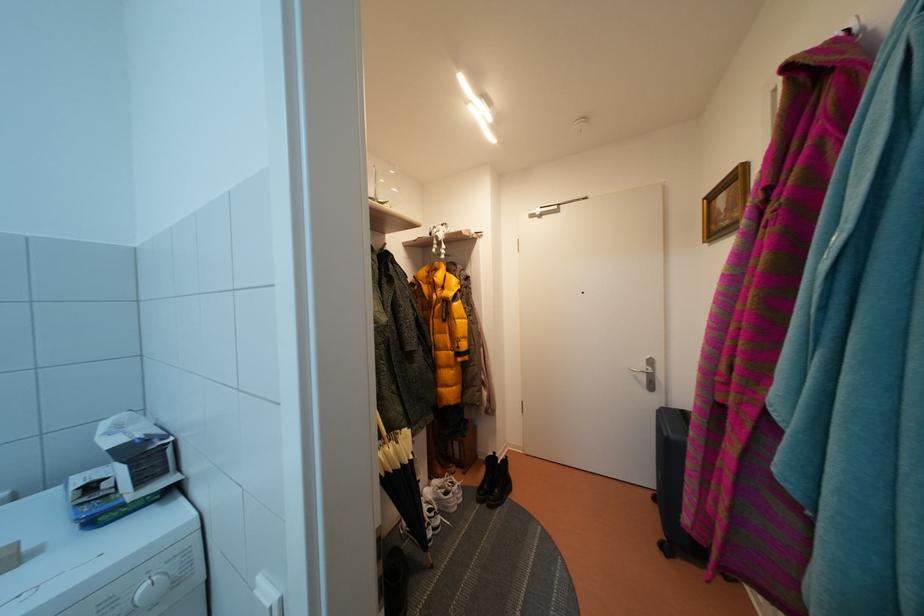
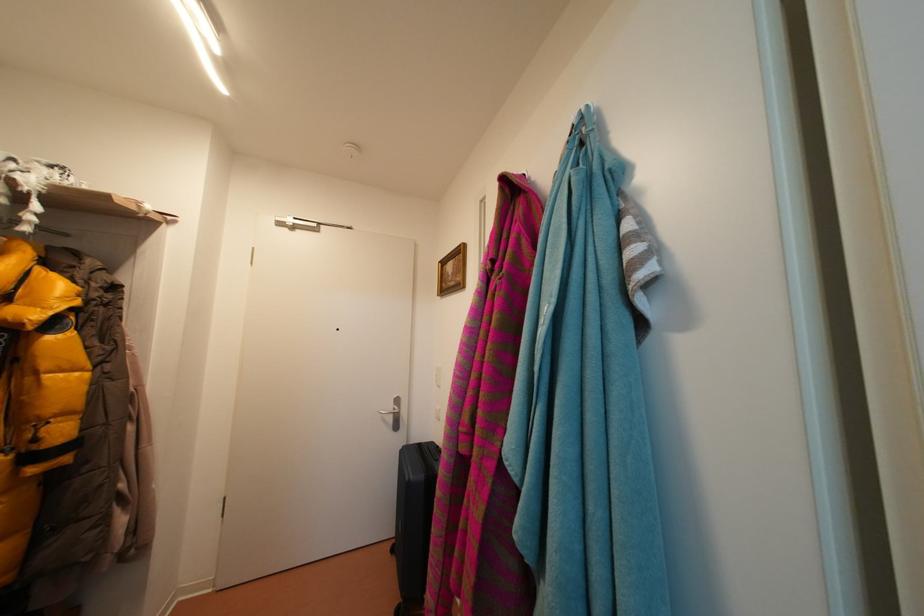
Question: The camera is either moving clockwise (left) or counter-clockwise (right) around the object. The first image is from the beginning of the video and the second image is from the end. Is the camera moving left or right when shooting the video?

Choices:
 (A) Left
 (B) Right

Answer: (A)